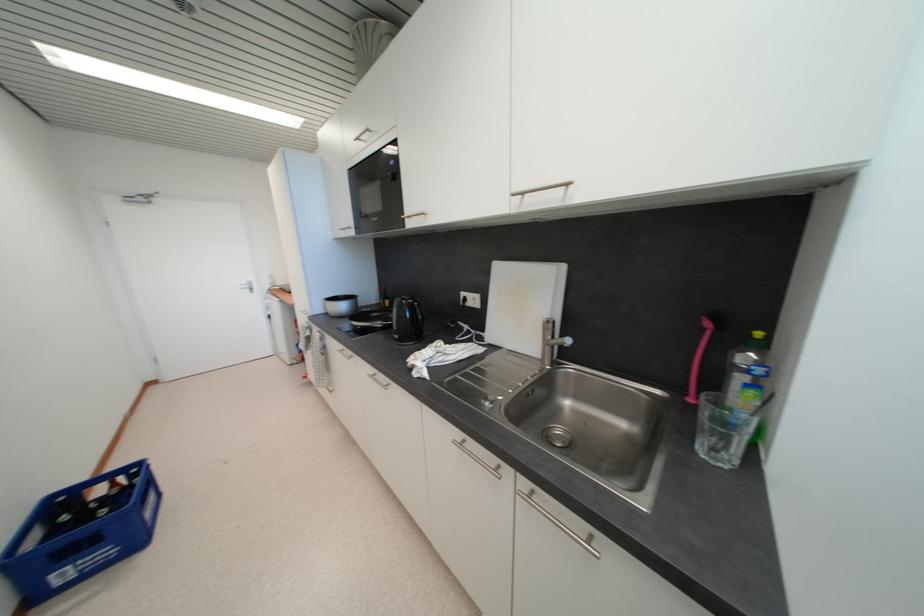
The width and height of the screenshot is (924, 616). What are the coordinates of `silver cooking pot` in the screenshot? It's located at (341, 305).